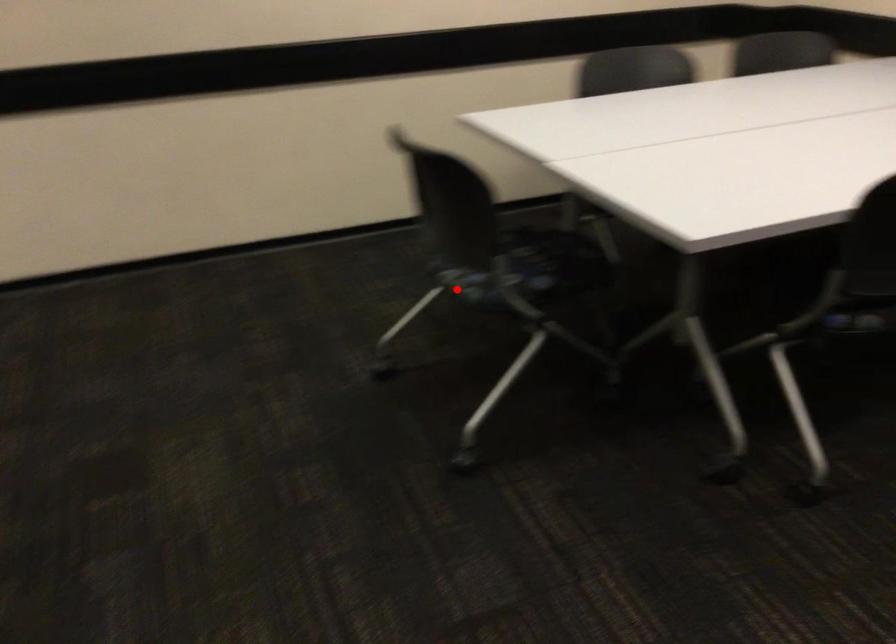
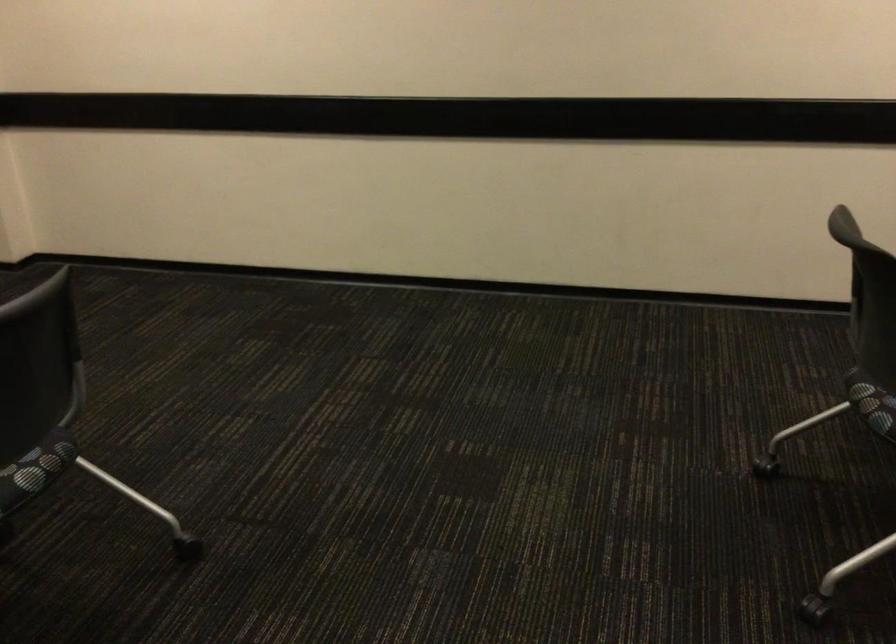
Find the pixel in the second image that matches the highlighted location in the first image.

(874, 408)